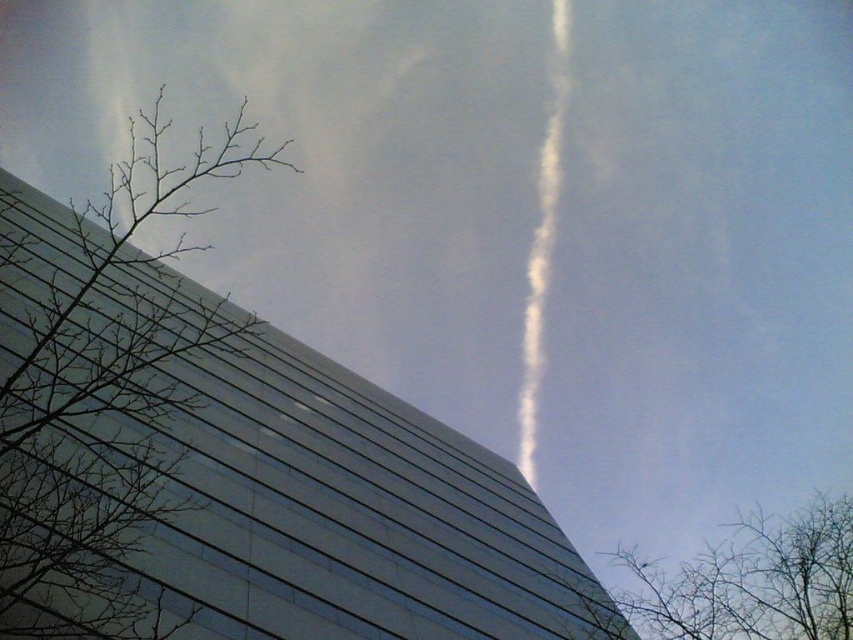
Between bare branches at left and white fluffy smoke at upper center, which one appears on the left side from the viewer's perspective?

Positioned to the left is bare branches at left.

Describe the element at coordinates (107, 401) in the screenshot. I see `bare branches at left` at that location.

Where is `bare branches at left`? Image resolution: width=853 pixels, height=640 pixels. bare branches at left is located at coordinates (107, 401).

Can you confirm if bare branches at left is positioned above bare branches at lower right?

Yes.

Is bare branches at left wider than bare branches at lower right?

Incorrect, bare branches at left's width does not surpass bare branches at lower right's.

Does point (10, 518) come behind point (780, 566)?

No, (10, 518) is closer to viewer.

Where is `bare branches at left`? The width and height of the screenshot is (853, 640). bare branches at left is located at coordinates (107, 401).

Does bare branches at lower right appear over white fluffy smoke at upper center?

Actually, bare branches at lower right is below white fluffy smoke at upper center.

Based on the photo, does bare branches at lower right have a larger size compared to white fluffy smoke at upper center?

Correct, bare branches at lower right is larger in size than white fluffy smoke at upper center.

Locate an element on the screen. The image size is (853, 640). bare branches at lower right is located at coordinates (741, 582).